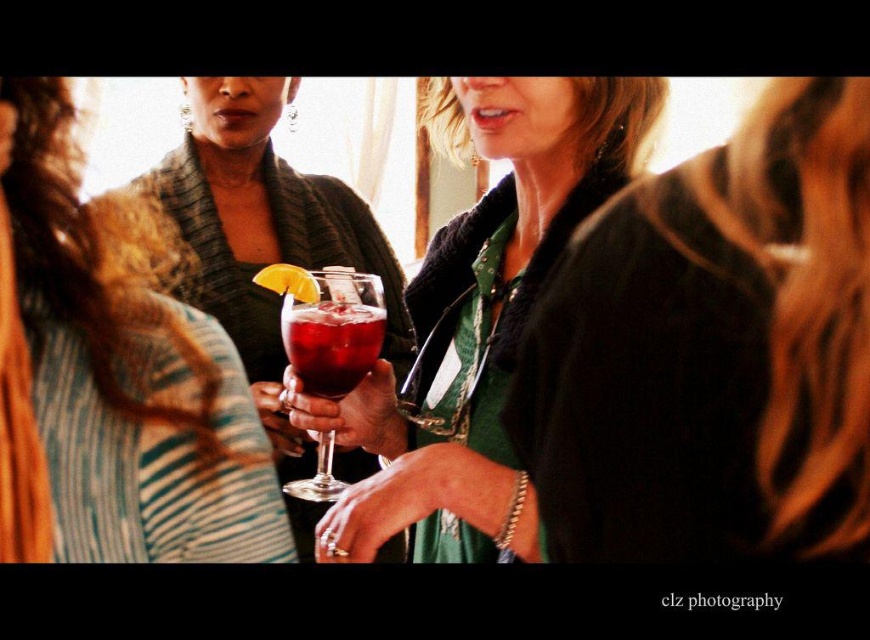
Which is below, matte glass wine at center or translucent glass wine glass at center?

Positioned lower is translucent glass wine glass at center.

Which is more to the right, matte glass wine at center or translucent glass wine glass at center?

Positioned to the right is matte glass wine at center.

Is point (512, 353) farther from viewer compared to point (357, 348)?

No, (512, 353) is closer to viewer.

The width and height of the screenshot is (870, 640). I want to click on matte glass wine at center, so pos(476,317).

From the picture: Which is below, green fabric dress at center or matte glass wine at center?

green fabric dress at center is lower down.

Which is behind, point (755, 502) or point (559, 218)?

Point (559, 218)

Who is more forward, (631, 237) or (559, 134)?

Point (631, 237)

Find the location of a particular element. The image size is (870, 640). green fabric dress at center is located at coordinates (713, 352).

Between point (663, 288) and point (169, 508), which one is positioned behind?

Positioned behind is point (169, 508).

Is green fabric dress at center to the left of matte black dress at center from the viewer's perspective?

In fact, green fabric dress at center is to the right of matte black dress at center.

Measure the distance between point (x=594, y=408) and camera.

13.32 inches

You are a GUI agent. You are given a task and a screenshot of the screen. Output one action in this format:
    pyautogui.click(x=<x>, y=<y>)
    Task: Click on the green fabric dress at center
    This screenshot has width=870, height=640.
    Given the screenshot: What is the action you would take?
    pyautogui.click(x=713, y=352)